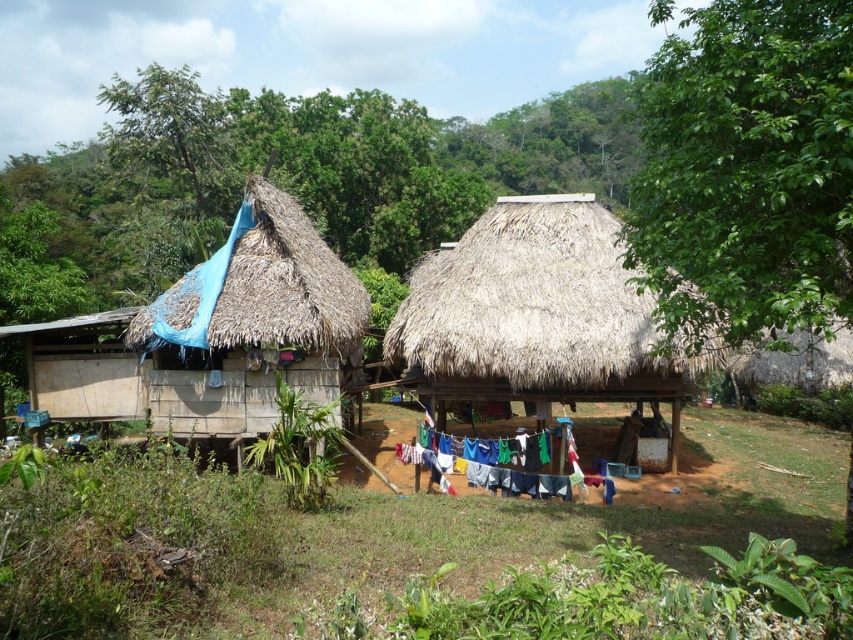
Does brown thatch roof at center appear on the right side of thatched straw roof at left?

Yes, brown thatch roof at center is to the right of thatched straw roof at left.

Who is more forward, (500, 365) or (242, 241)?

Point (500, 365) is in front.

Does point (431, 307) come closer to viewer compared to point (241, 307)?

No, it is behind (241, 307).

You are a GUI agent. You are given a task and a screenshot of the screen. Output one action in this format:
    pyautogui.click(x=<x>, y=<y>)
    Task: Click on the brown thatch roof at center
    The height and width of the screenshot is (640, 853).
    Given the screenshot: What is the action you would take?
    pyautogui.click(x=537, y=305)

Does thatched straw roof at left appear under multicolored fabric at center?

Incorrect, thatched straw roof at left is not positioned below multicolored fabric at center.

Based on the photo, who is positioned more to the right, thatched straw roof at left or multicolored fabric at center?

multicolored fabric at center is more to the right.

Is point (337, 339) more distant than point (482, 474)?

That is True.

In order to click on thatched straw roof at left in this screenshot , I will do `click(260, 289)`.

Between point (480, 285) and point (503, 486), which one is positioned in front?

Positioned in front is point (503, 486).

Does point (544, 227) lie behind point (497, 477)?

That is True.

The width and height of the screenshot is (853, 640). What are the coordinates of `brown thatch roof at center` in the screenshot? It's located at (537, 305).